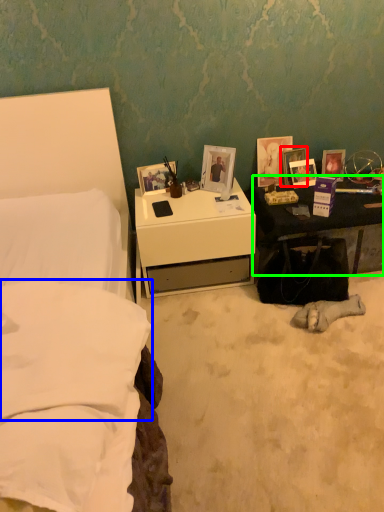
Question: Which object is the closest to the picture frame (highlighted by a red box)? Choose among these: pillow (highlighted by a blue box) or nightstand (highlighted by a green box).

Choices:
 (A) pillow
 (B) nightstand

Answer: (B)